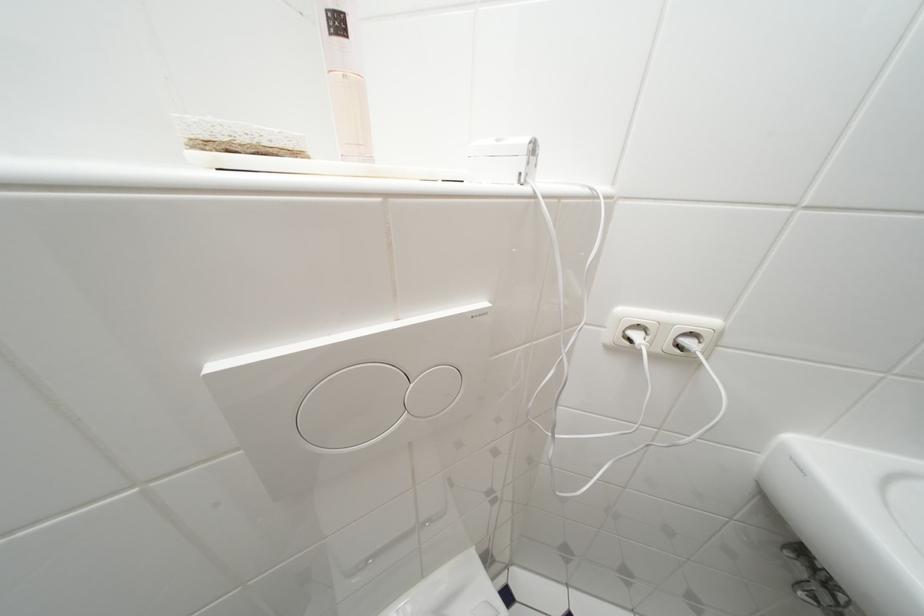
Where would you grasp the layered sponge? Please return your answer as a coordinate pair (x, y).

(237, 138)